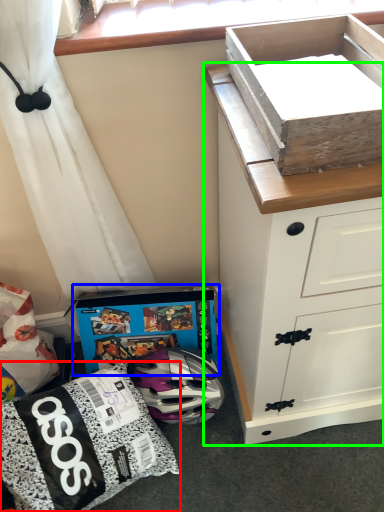
Question: Which object is the farthest from kit (highlighted by a red box)? Choose among these: cardboard box (highlighted by a blue box) or chest of drawers (highlighted by a green box).

Choices:
 (A) cardboard box
 (B) chest of drawers

Answer: (B)